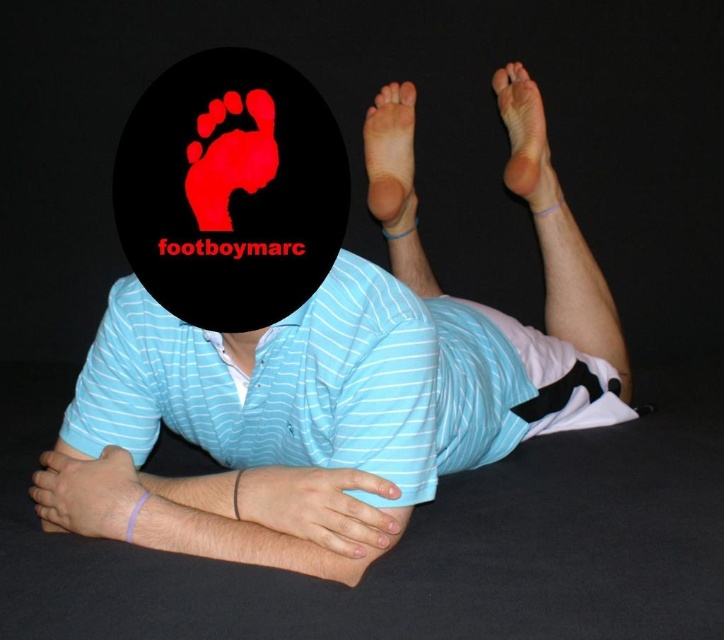
Is smooth skin foot at upper center thinner than smooth skin foot at upper right?

Yes, smooth skin foot at upper center is thinner than smooth skin foot at upper right.

The image size is (724, 640). I want to click on smooth skin foot at upper center, so click(x=391, y=157).

Locate an element on the screen. This screenshot has width=724, height=640. smooth skin foot at upper center is located at coordinates (391, 157).

Does light blue striped shirt at center appear on the right side of smooth skin foot at upper right?

No, light blue striped shirt at center is not to the right of smooth skin foot at upper right.

Can you confirm if light blue striped shirt at center is positioned above smooth skin foot at upper right?

Incorrect, light blue striped shirt at center is not positioned above smooth skin foot at upper right.

Does point (374, 372) come behind point (531, 88)?

No.

Find the location of `light blue striped shirt at center`. light blue striped shirt at center is located at coordinates (348, 390).

Does smooth skin hand at center have a smaller size compared to pale skin hand at lower left?

Incorrect, smooth skin hand at center is not smaller in size than pale skin hand at lower left.

Who is more distant from viewer, (303, 502) or (96, 524)?

Point (96, 524)

I want to click on smooth skin hand at center, so click(319, 506).